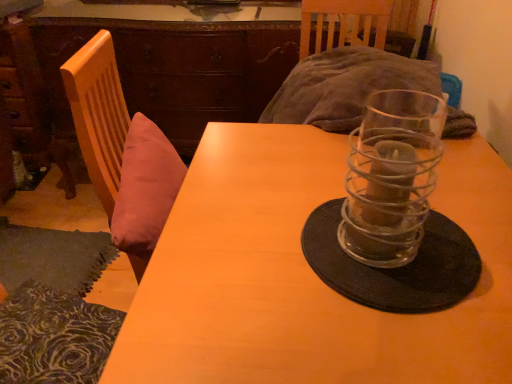
Where is `free space in front of clear glass candle holder at center`? free space in front of clear glass candle holder at center is located at coordinates (404, 342).